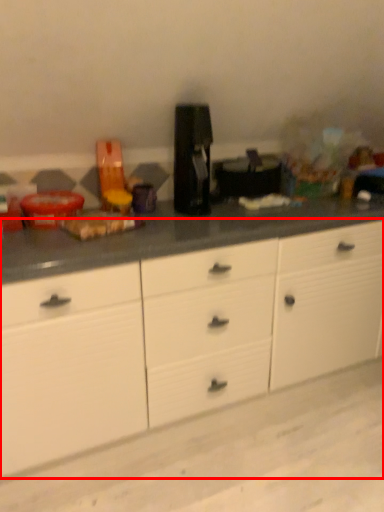
Question: In this image, where is cabinetry (annotated by the red box) located relative to coffee machine?

Choices:
 (A) right
 (B) left

Answer: (A)